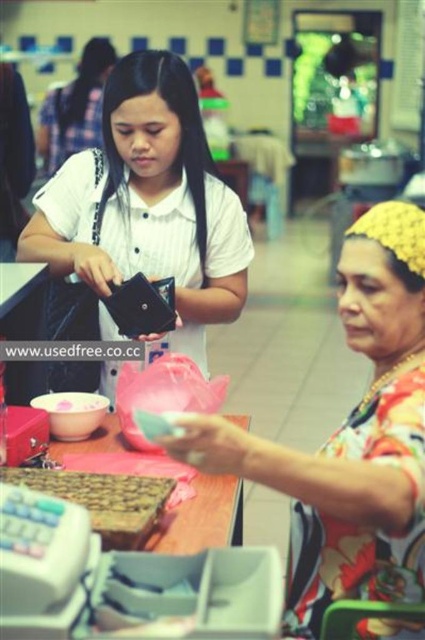
Between floral fabric blouse at center and wooden tray at lower left, which one appears on the right side from the viewer's perspective?

floral fabric blouse at center is more to the right.

Does floral fabric blouse at center have a smaller size compared to wooden tray at lower left?

No.

Locate an element on the screen. Image resolution: width=425 pixels, height=640 pixels. floral fabric blouse at center is located at coordinates (351, 438).

Where is `floral fabric blouse at center`? The height and width of the screenshot is (640, 425). floral fabric blouse at center is located at coordinates (351, 438).

Does floral fabric blouse at center come in front of matte black wallet at center?

Yes, it is in front of matte black wallet at center.

Can you confirm if floral fabric blouse at center is positioned to the right of matte black wallet at center?

Indeed, floral fabric blouse at center is positioned on the right side of matte black wallet at center.

Between point (354, 484) and point (218, 257), which one is positioned in front?

Point (354, 484) is more forward.

Locate an element on the screen. The height and width of the screenshot is (640, 425). floral fabric blouse at center is located at coordinates (351, 438).

Can you confirm if wooden tray at lower left is taller than wooden table at center?

In fact, wooden tray at lower left may be shorter than wooden table at center.

Between wooden tray at lower left and wooden table at center, which one has less height?

With less height is wooden tray at lower left.

Where is `wooden tray at lower left`? wooden tray at lower left is located at coordinates (102, 499).